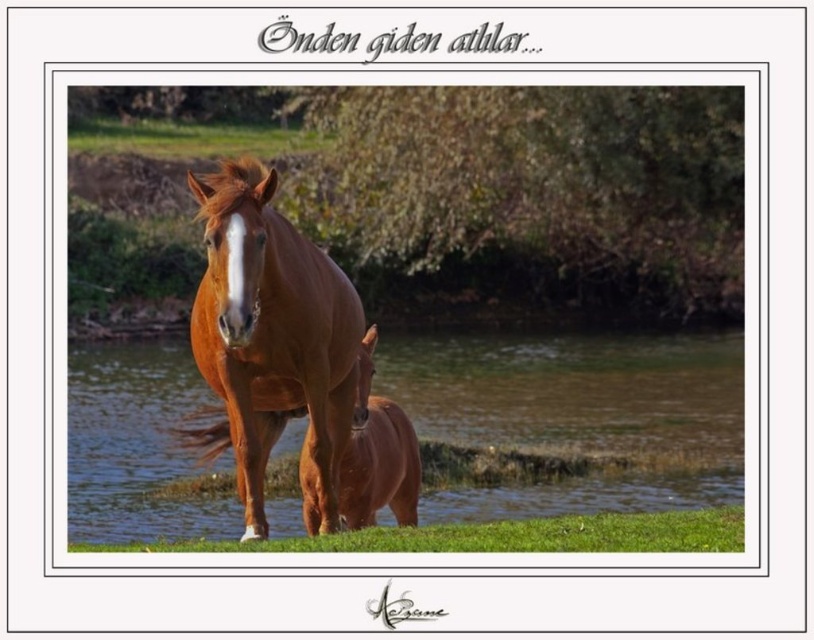
Question: Is brown glossy water at center to the left of brown glossy horse at center from the viewer's perspective?

Choices:
 (A) no
 (B) yes

Answer: (A)

Question: Which of the following is the closest to the observer?

Choices:
 (A) (274, 451)
 (B) (208, 243)

Answer: (B)

Question: Is brown glossy water at center bigger than brown glossy horse at center?

Choices:
 (A) yes
 (B) no

Answer: (A)

Question: Considering the relative positions of brown glossy water at center and brown glossy horse at center in the image provided, where is brown glossy water at center located with respect to brown glossy horse at center?

Choices:
 (A) above
 (B) below

Answer: (B)

Question: Which point is farther to the camera?

Choices:
 (A) brown glossy horse at center
 (B) brown glossy water at center

Answer: (B)